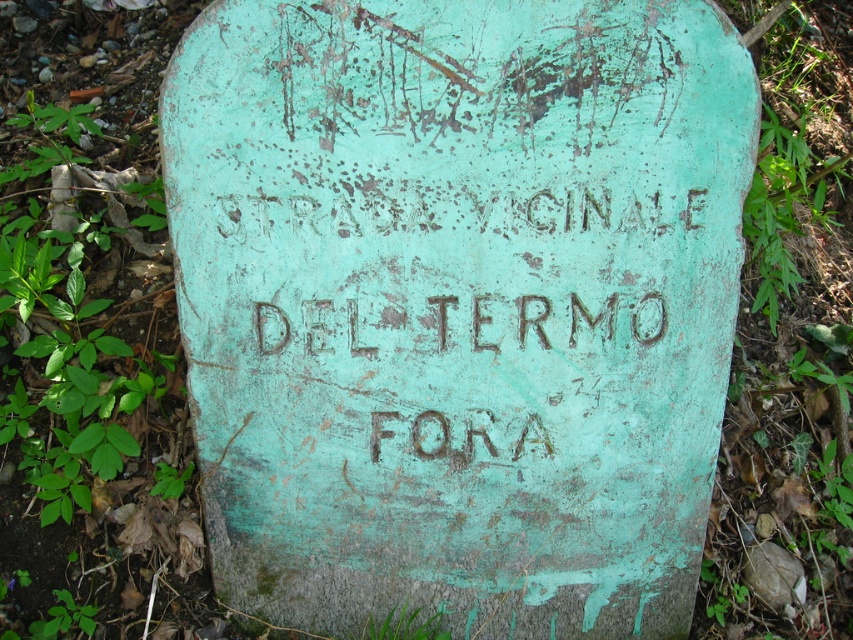
You are hiking on a trail and come across a green patina stone sign at center and a green patina stone at lower right. Which object is positioned higher up in the scene?

The green patina stone sign at center is located above the green patina stone at lower right, so it is positioned higher up in the scene.

You are a hiker trying to read the text on the green patina stone sign at center. There is a green patina stone at lower right nearby. Which object is taller?

The green patina stone sign at center is taller than the green patina stone at lower right.

You are standing in front of the green patina stone sign at center. Based on its location at coordinates point 0.477, 0.538, can you determine if it is positioned closer to the top or bottom of the image?

The green patina stone sign at center is located at point (457, 305), which places it near the center of the image. Since the coordinates are approximately 0.5 in both x and y directions, it is equally distant from the top and bottom of the image.